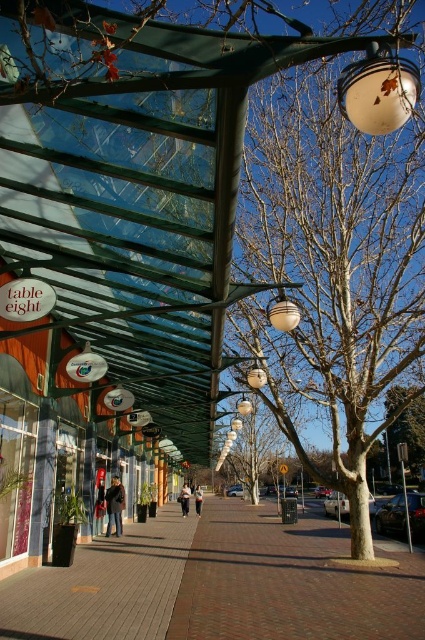
Question: Can you confirm if white glass lamp at upper right is smaller than green leafy tree at center?

Choices:
 (A) yes
 (B) no

Answer: (A)

Question: Among these points, which one is farthest from the camera?

Choices:
 (A) (402, 72)
 (B) (410, 545)
 (C) (234, 516)

Answer: (C)

Question: Is green leafy tree at center behind light brown leather jacket at center?

Choices:
 (A) yes
 (B) no

Answer: (B)

Question: Estimate the real-world distances between objects in this image. Which object is farther from the bare branches at center?

Choices:
 (A) white bark tree at center
 (B) green leafy tree at center
 (C) metallic pole at center

Answer: (C)

Question: Can you confirm if brick pavement at center is wider than white glass lamp at upper right?

Choices:
 (A) yes
 (B) no

Answer: (A)

Question: Which is nearer to the white glass lamp at upper right?

Choices:
 (A) dark blue jacket at center
 (B) white bark tree at center
 (C) brown brick pavement at center

Answer: (C)